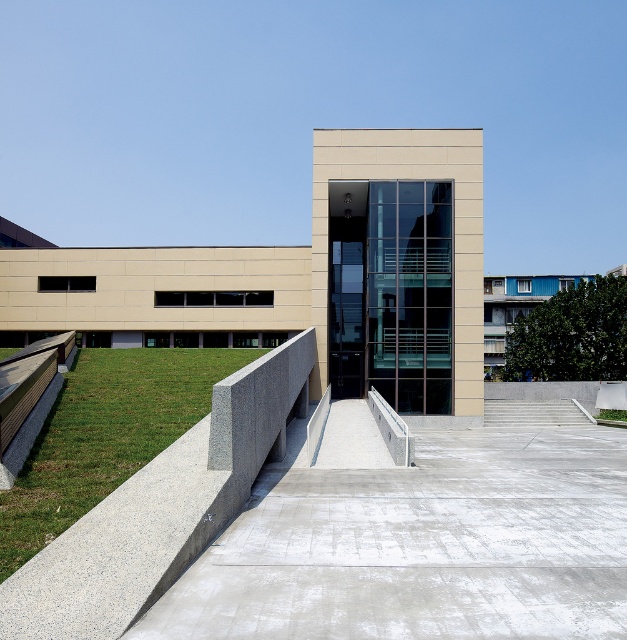
Where is `gray concrete at center`? gray concrete at center is located at coordinates (423, 545).

Does point (335, 496) come closer to viewer compared to point (534, 420)?

Yes, it is in front of point (534, 420).

This screenshot has width=627, height=640. Find the location of `gray concrete at center`. gray concrete at center is located at coordinates point(423,545).

Is point (100, 369) less distant than point (569, 420)?

Yes, it is in front of point (569, 420).

Is green grass at lower left further to camera compared to concrete stairs at center?

No, green grass at lower left is closer to the viewer.

Who is more distant from viewer, (166, 358) or (566, 416)?

The point (566, 416) is more distant.

The width and height of the screenshot is (627, 640). I want to click on green grass at lower left, so click(x=103, y=435).

Between point (606, 554) and point (80, 500), which one is positioned behind?

Positioned behind is point (80, 500).

Between point (508, 566) and point (108, 490), which one is positioned in front?

Positioned in front is point (508, 566).

The image size is (627, 640). Find the location of `gray concrete at center`. gray concrete at center is located at coordinates (423, 545).